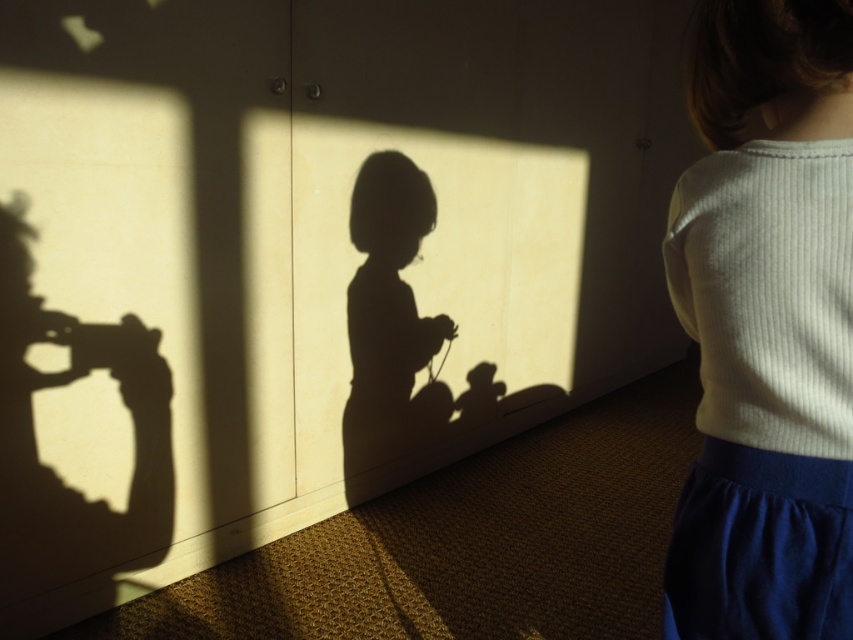
You are standing in the room and see the point at coordinates (766, 326). What object is located at that point?

The point at coordinates (766, 326) corresponds to the white ribbed sweater at upper right.

You are a photographer trying to position yourself between the white ribbed sweater at upper right and the matte black camera at left to take a photo. Can you fit yourself in the space between them if you are 1.5 meters wide?

The distance between the white ribbed sweater at upper right and the matte black camera at left is 1.47 meters, which is slightly narrower than your 1.5 meters width. Therefore, you cannot fit comfortably between them without adjusting your position.